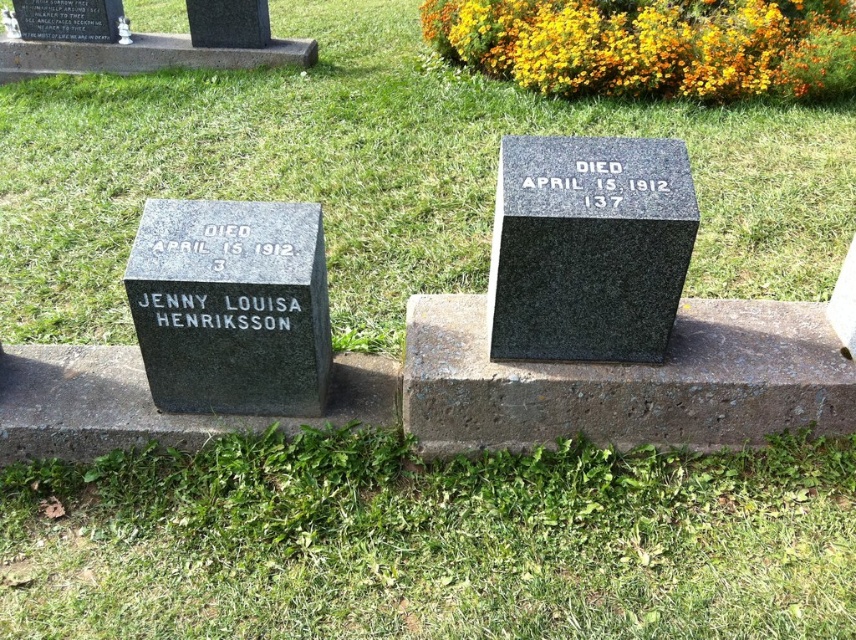
Question: Which point appears closest to the camera in this image?

Choices:
 (A) (510, 280)
 (B) (379, 589)
 (C) (241, 282)
 (D) (152, 100)

Answer: (B)

Question: Is green grass at lower center further to camera compared to black granite gravestone at center?

Choices:
 (A) no
 (B) yes

Answer: (A)

Question: Can you confirm if green grass at lower center is smaller than green grass at center?

Choices:
 (A) no
 (B) yes

Answer: (A)

Question: Which object appears closest to the camera in this image?

Choices:
 (A) black granite gravestone at center
 (B) green grass at center
 (C) green grass at lower center

Answer: (C)

Question: Can you confirm if green grass at lower center is wider than black granite gravestone at center?

Choices:
 (A) yes
 (B) no

Answer: (A)

Question: Which point appears closest to the camera in this image?

Choices:
 (A) (544, 205)
 (B) (789, 541)

Answer: (A)